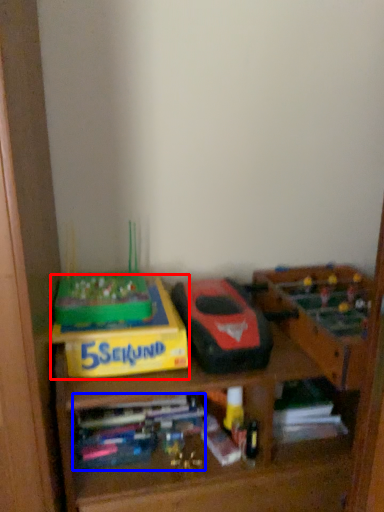
Question: Which object appears closest to the camera in this image, cardboard box (highlighted by a red box) or book (highlighted by a blue box)?

Choices:
 (A) cardboard box
 (B) book

Answer: (A)